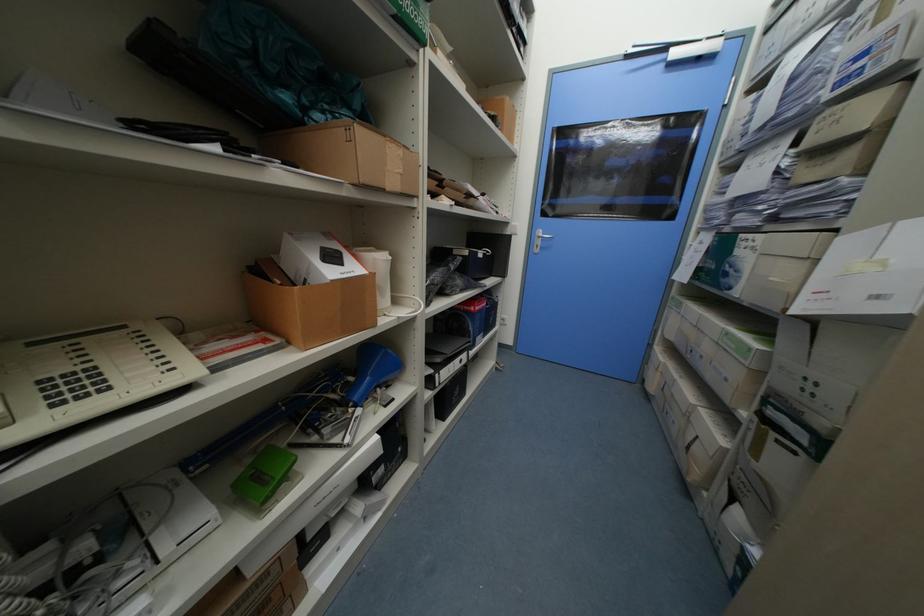
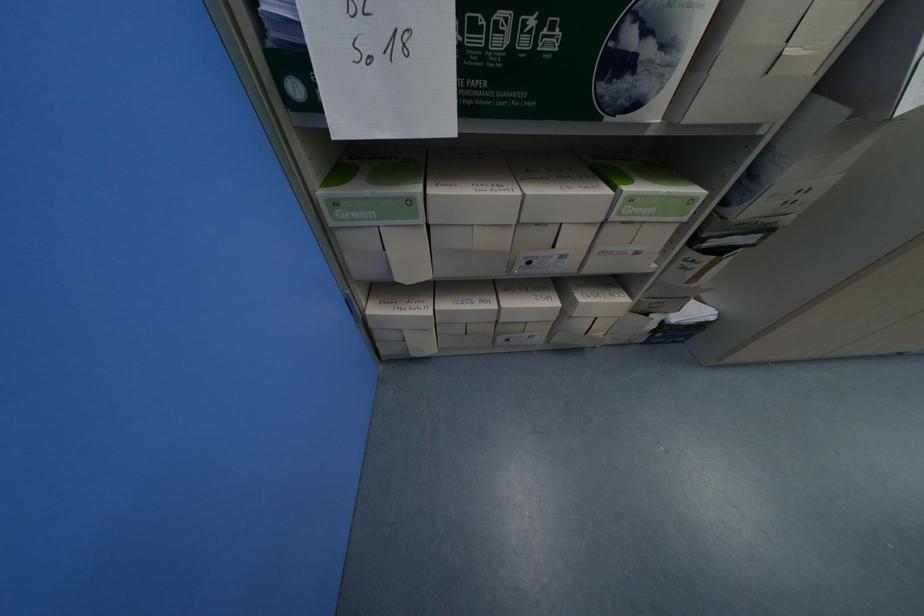
Find the pixel in the second image that matches [663,351] in the first image.

(381, 312)